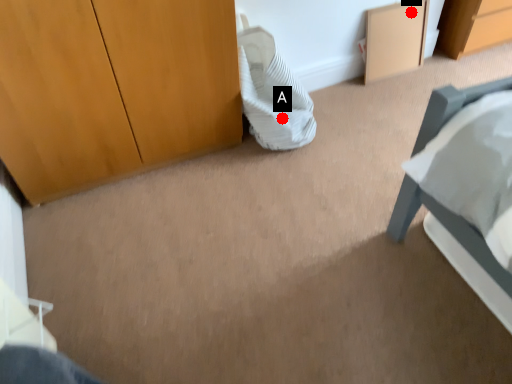
Question: Two points are circled on the image, labeled by A and B beside each circle. Which point is further to the camera?

Choices:
 (A) A is further
 (B) B is further

Answer: (B)